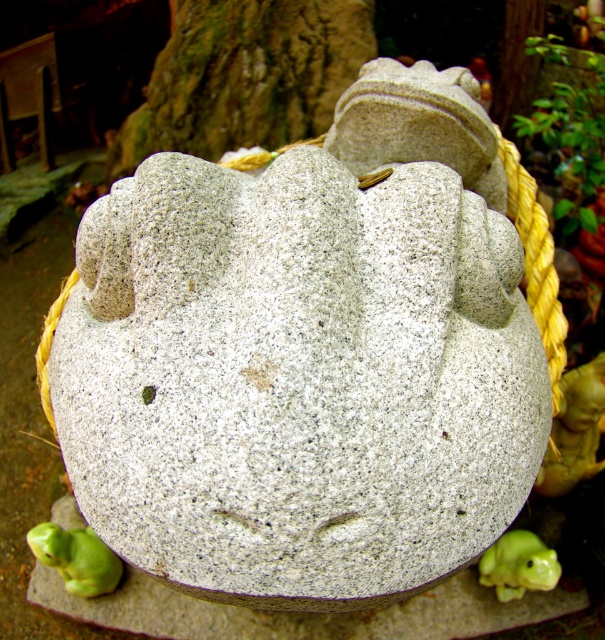
Can you confirm if gray granite stone at center is positioned above green rubber frog at lower right?

No, gray granite stone at center is not above green rubber frog at lower right.

Which is below, gray granite stone at center or green rubber frog at lower right?

gray granite stone at center

You are a GUI agent. You are given a task and a screenshot of the screen. Output one action in this format:
    pyautogui.click(x=<x>, y=<y>)
    Task: Click on the gray granite stone at center
    
    Given the screenshot: What is the action you would take?
    pyautogui.click(x=301, y=612)

Can you confirm if granite statue at upper center is positioned to the right of green rubber frog at lower right?

In fact, granite statue at upper center is to the left of green rubber frog at lower right.

You are a GUI agent. You are given a task and a screenshot of the screen. Output one action in this format:
    pyautogui.click(x=<x>, y=<y>)
    Task: Click on the granite statue at upper center
    Image resolution: width=605 pixels, height=640 pixels.
    Given the screenshot: What is the action you would take?
    pyautogui.click(x=417, y=124)

Does point (82, 355) come closer to viewer compared to point (594, 400)?

Yes, it is in front of point (594, 400).

Who is more distant from viewer, (257, 557) or (578, 381)?

The point (578, 381) is more distant.

What are the coordinates of `gray granite frog at center` in the screenshot? It's located at (298, 380).